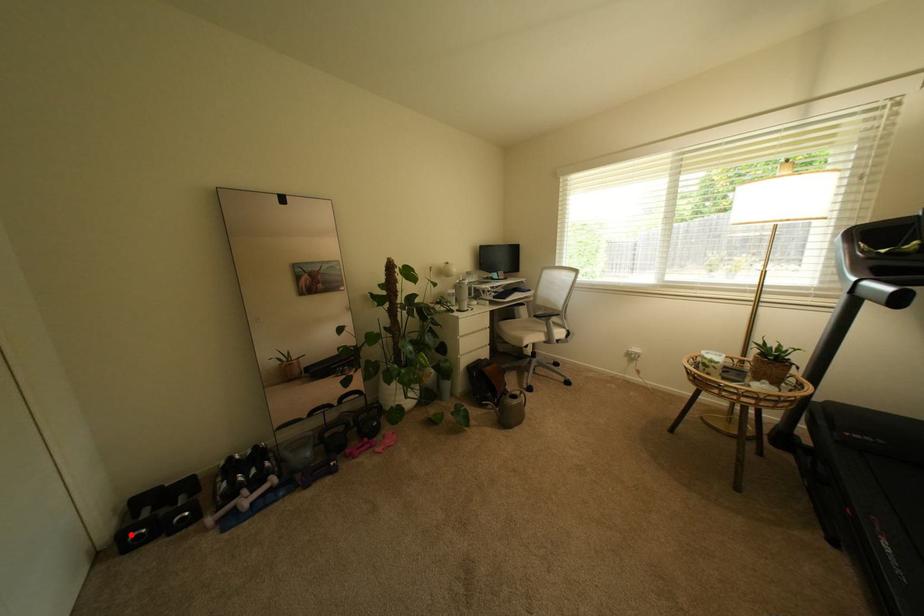
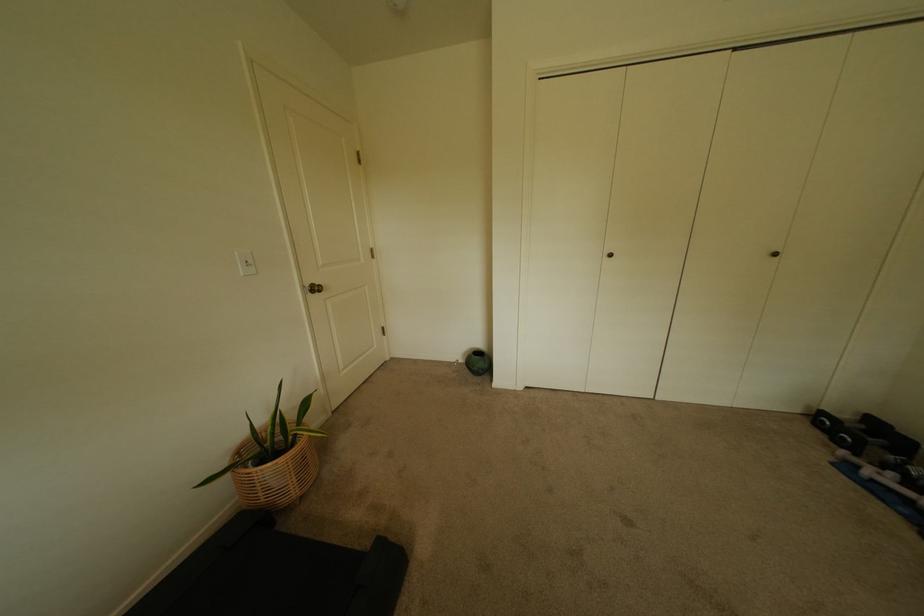
Question: I am providing you with two images of the same scene from different viewpoints. In image1, a red point is highlighted. Considering the same 3D point in image2, which of the following is correct?

Choices:
 (A) It is closer
 (B) It is farther

Answer: (B)